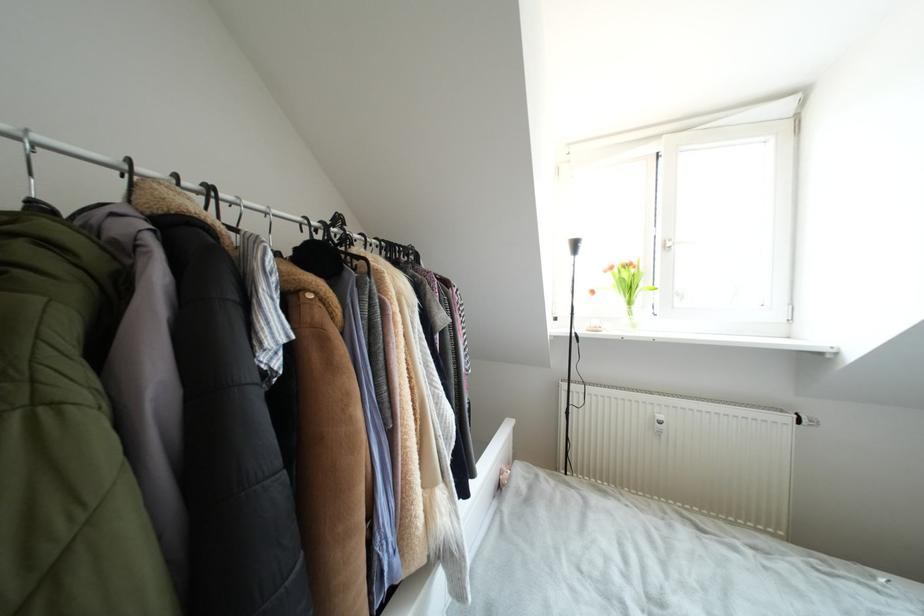
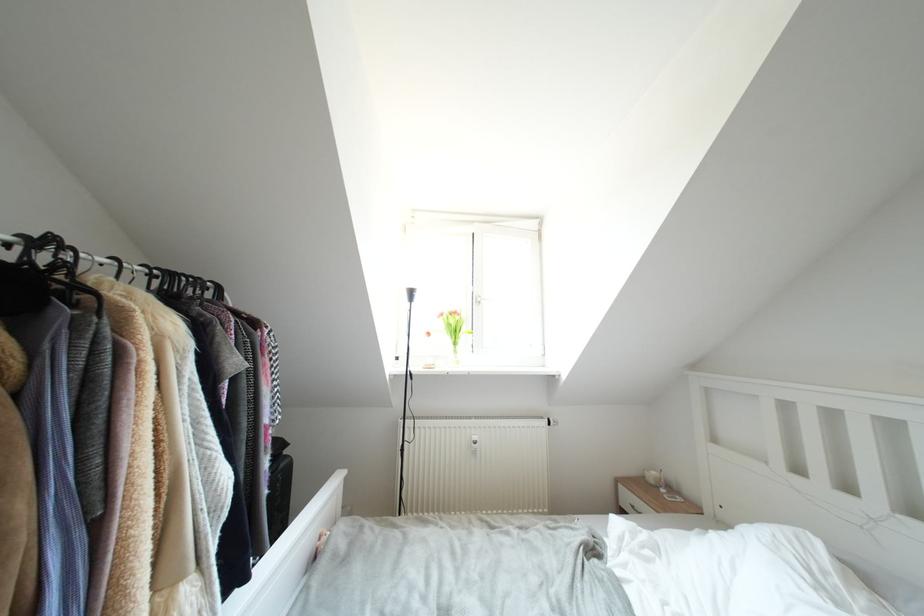
Question: The images are taken continuously from a first-person perspective. In which direction is your viewpoint rotating?

Choices:
 (A) Left
 (B) Right
 (C) Up
 (D) Down

Answer: (B)